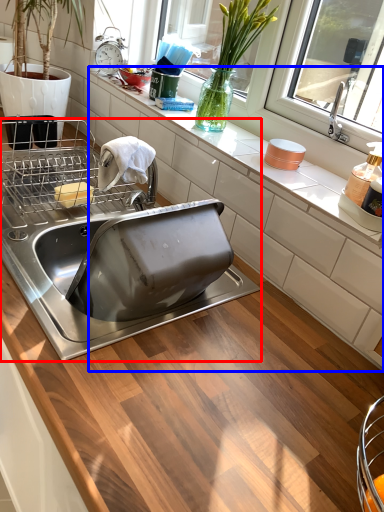
Question: Among these objects, which one is nearest to the camera, sink (highlighted by a red box) or countertop (highlighted by a blue box)?

Choices:
 (A) sink
 (B) countertop

Answer: (A)